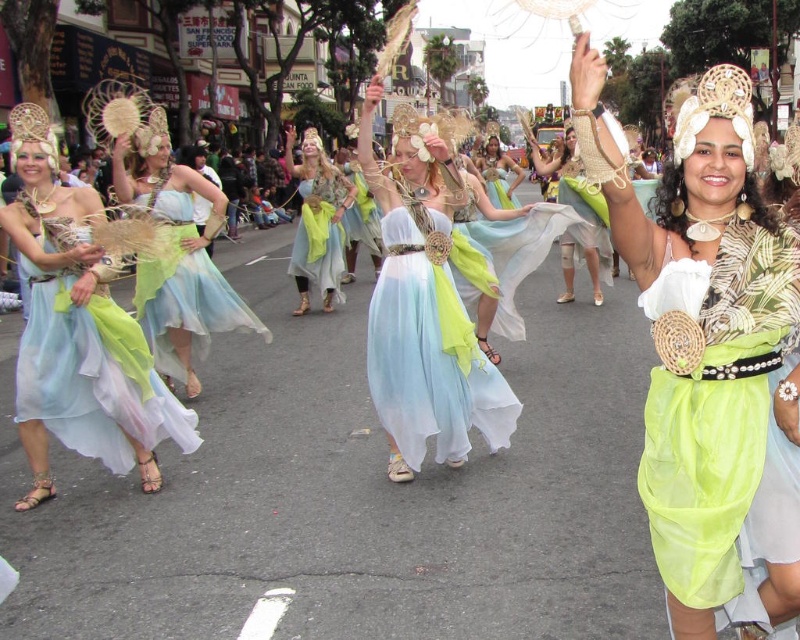
You are a photographer standing at the edge of the parade. You want to capture a photo of the lime green fabric skirt at center and the matte straw hat at center in the same frame. Given that your camera has a maximum focus range of 20 feet, will both objects be in focus?

The distance between the lime green fabric skirt at center and the matte straw hat at center is 24.15 feet. Since the camera can only focus up to 20 feet, the objects are beyond the focus range, so they won t be in focus together.